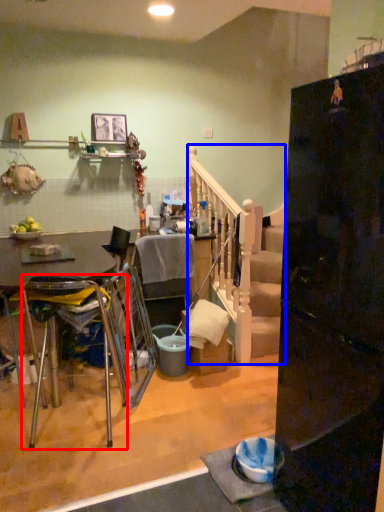
Question: Which of the following is the closest to the observer, chair (highlighted by a red box) or rail (highlighted by a blue box)?

Choices:
 (A) chair
 (B) rail

Answer: (A)